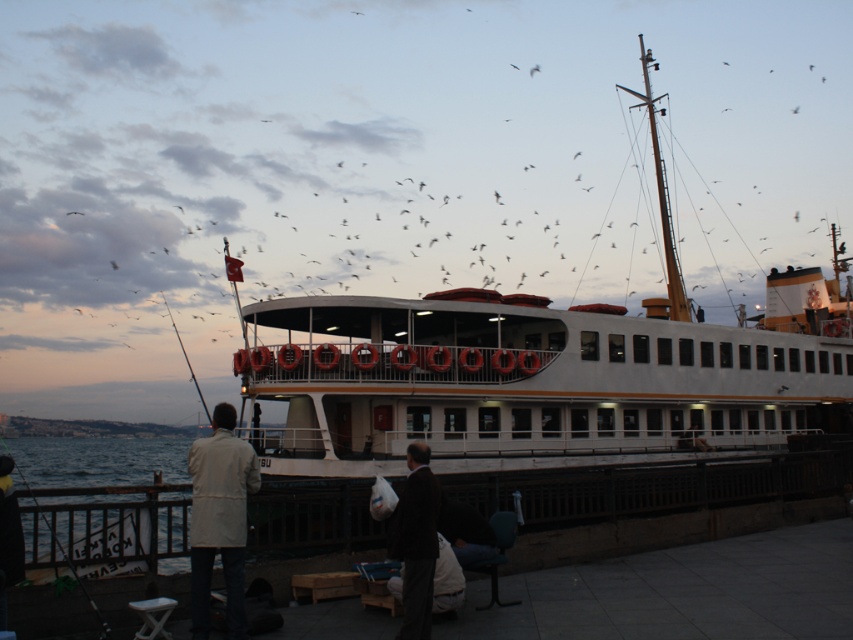
Question: Which point is farther to the camera?

Choices:
 (A) (3, 536)
 (B) (204, 564)

Answer: (B)

Question: Can you confirm if black plastic fishing pole at lower left is positioned to the right of metallic fishing pole at upper left?

Choices:
 (A) yes
 (B) no

Answer: (B)

Question: Can you confirm if white matte boat at center is positioned to the right of black plastic fishing pole at lower left?

Choices:
 (A) no
 (B) yes

Answer: (B)

Question: Which of the following is the closest to the observer?

Choices:
 (A) (3, 602)
 (B) (222, 568)

Answer: (A)

Question: Is white matte jacket at lower left positioned before metallic fishing pole at upper left?

Choices:
 (A) no
 (B) yes

Answer: (B)

Question: Which of the following is the farthest from the observer?

Choices:
 (A) black plastic fishing pole at lower left
 (B) white matte boat at center
 (C) metallic fishing pole at upper left
 (D) white cotton jacket at lower left

Answer: (C)